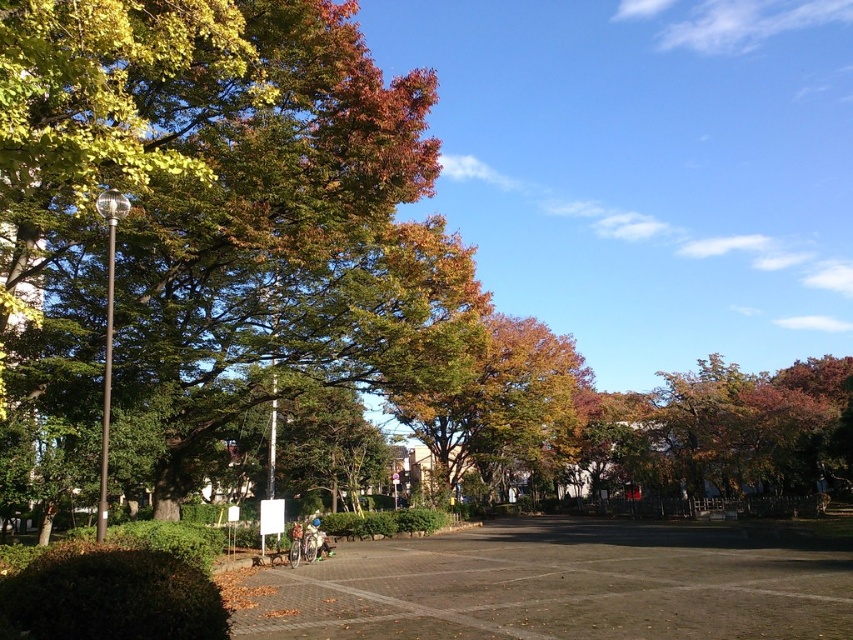
You are planning to install a new light fixture in the park. The light needs to be placed above the gray concrete parking lot at center. Considering the green leafy tree at left, will the tree interfere with the installation or casting of light onto the parking lot?

The green leafy tree at left is taller than the gray concrete parking lot at center, so its branches may block the light fixture above the parking lot, causing shadows or interference. Consider adjusting the height or position of the light fixture to avoid the tree.

You are standing at the point labeled point (175, 68) and want to walk towards the point labeled point (498, 476). Given that both points are on the same path, which direction should you face to move towards the second point?

Since point (175, 68) is closer to the viewer than point (498, 476), you should face away from the viewer to move towards the second point.